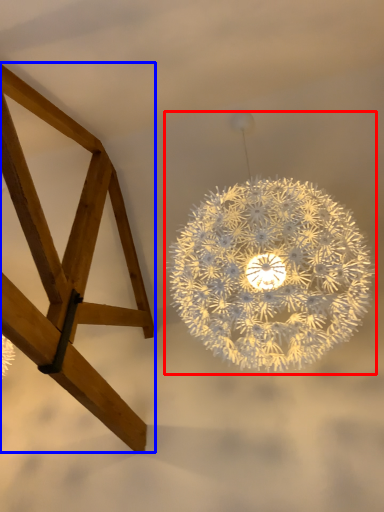
Question: Which object appears closest to the camera in this image, lamp (highlighted by a red box) or furniture (highlighted by a blue box)?

Choices:
 (A) lamp
 (B) furniture

Answer: (B)